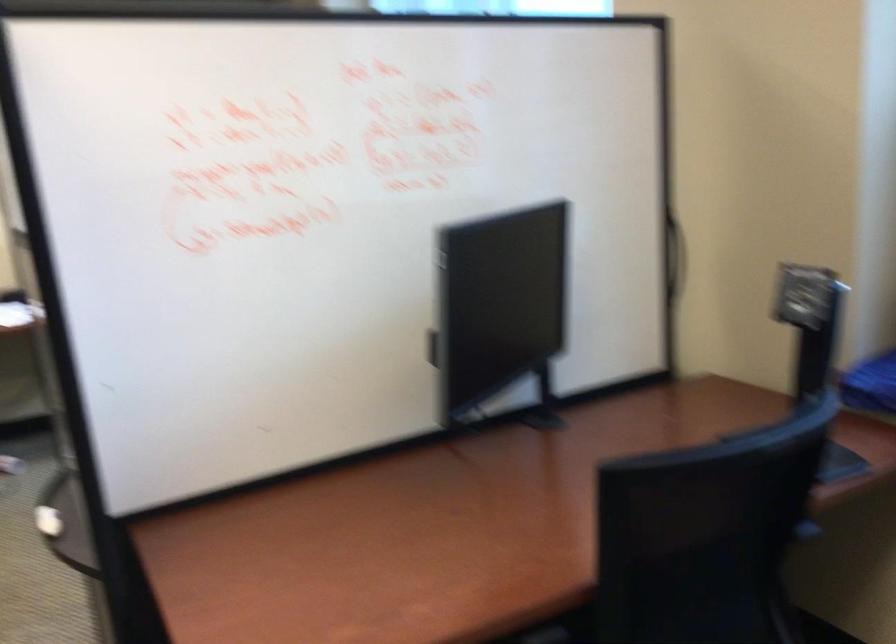
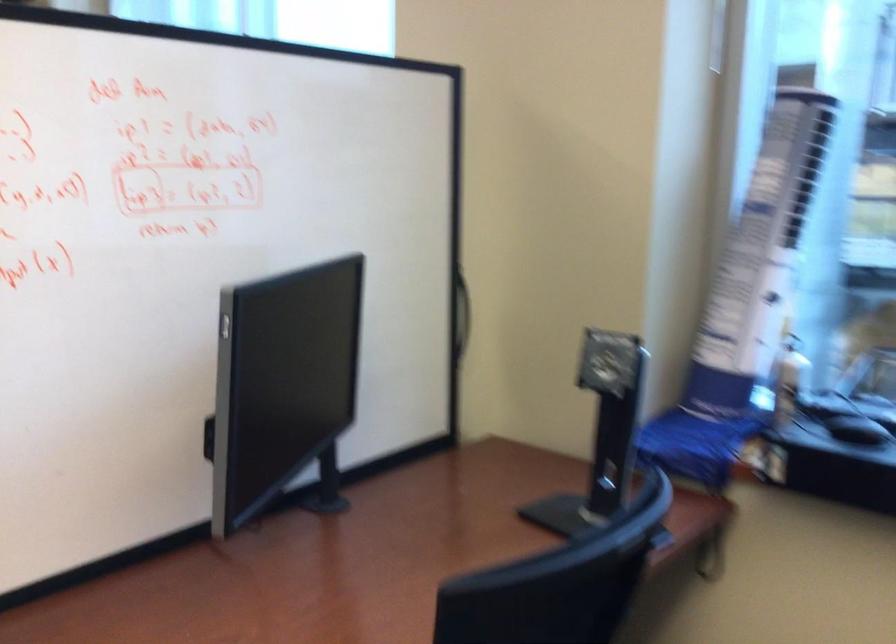
In a continuous first-person perspective shot, in which direction is the camera moving?

The cameraman moved toward left, forward.